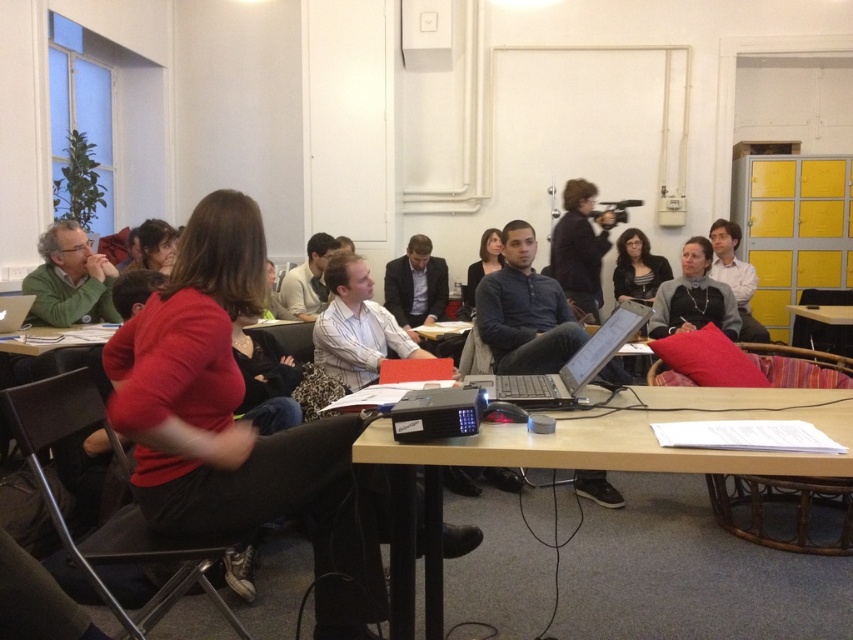
I want to click on matte black projector at center, so click(587, 461).

Is matte black projector at center shorter than wooden table at center?

Incorrect, matte black projector at center's height does not fall short of wooden table at center's.

Image resolution: width=853 pixels, height=640 pixels. What do you see at coordinates (587, 461) in the screenshot? I see `matte black projector at center` at bounding box center [587, 461].

Locate an element on the screen. This screenshot has height=640, width=853. matte black projector at center is located at coordinates click(x=587, y=461).

Who is positioned more to the left, green matte sweater at left or matte gray sweater at center?

From the viewer's perspective, green matte sweater at left appears more on the left side.

Based on the photo, between green matte sweater at left and matte gray sweater at center, which one has more height?

matte gray sweater at center

Who is more distant from viewer, [62,282] or [712,285]?

The point [712,285] is more distant.

At what (x,y) coordinates should I click in order to perform the action: click on green matte sweater at left. Please return your answer as a coordinate pair (x, y). This screenshot has height=640, width=853. Looking at the image, I should click on point(68,280).

Looking at this image, does wooden table at center appear on the left side of matte black laptop at left?

In fact, wooden table at center is to the right of matte black laptop at left.

How much distance is there between wooden table at center and matte black laptop at left?

wooden table at center is 9.48 inches away from matte black laptop at left.

Identify the location of wooden table at center. (54, 337).

In order to click on wooden table at center in this screenshot , I will do point(54,337).